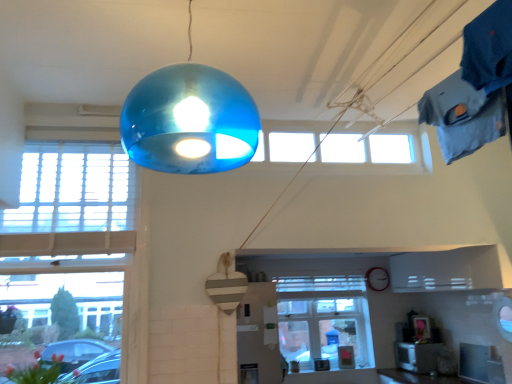
What is the approximate width of vivid pink petals at lower left?

It is 9.75 inches.

This screenshot has width=512, height=384. What do you see at coordinates (374, 151) in the screenshot? I see `transparent glass window at upper center, which is the second window in left-to-right order` at bounding box center [374, 151].

Describe the element at coordinates (74, 229) in the screenshot. I see `white wooden window at left, which is the 1th window in front-to-back order` at that location.

This screenshot has width=512, height=384. What do you see at coordinates (323, 319) in the screenshot?
I see `clear glass window at center, the first window from the back` at bounding box center [323, 319].

Locate an element on the screen. This screenshot has width=512, height=384. vivid pink petals at lower left is located at coordinates (36, 371).

Is vivid pink petals at lower left in front of white wooden window at left, which is the 1th window in front-to-back order?

That is True.

From the image's perspective, is vivid pink petals at lower left over white wooden window at left, which is the 1th window from left to right?

No, from the image's perspective, vivid pink petals at lower left is not on top of white wooden window at left, which is the 1th window from left to right.

Does vivid pink petals at lower left have a lesser height compared to white wooden window at left, marked as the 3th window in a right-to-left arrangement?

Correct, vivid pink petals at lower left is not as tall as white wooden window at left, marked as the 3th window in a right-to-left arrangement.

Is vivid pink petals at lower left inside the boundaries of white wooden window at left, which is the 1th window in front-to-back order, or outside?

A: vivid pink petals at lower left is contained in white wooden window at left, which is the 1th window in front-to-back order.

Considering the sizes of objects transparent glass window at upper center, arranged as the second window when viewed from the front, and white wooden window at left, which is the 1th window from left to right, in the image provided, who is smaller, transparent glass window at upper center, arranged as the second window when viewed from the front, or white wooden window at left, which is the 1th window from left to right,?

Smaller between the two is transparent glass window at upper center, arranged as the second window when viewed from the front.

Is transparent glass window at upper center, arranged as the second window when viewed from the front, facing towards white wooden window at left, arranged as the 3th window when viewed from the back?

No.

How distant is transparent glass window at upper center, placed as the 2th window when sorted from right to left, from white wooden window at left, which is the 1th window in front-to-back order?

1.43 meters.

In terms of width, does transparent glass window at upper center, which is the second window in left-to-right order, look wider or thinner when compared to white wooden window at left, arranged as the 3th window when viewed from the back?

transparent glass window at upper center, which is the second window in left-to-right order, is thinner than white wooden window at left, arranged as the 3th window when viewed from the back.

Can you see white wooden window at left, which is the 1th window from left to right, touching vivid pink petals at lower left?

No, white wooden window at left, which is the 1th window from left to right, is not with vivid pink petals at lower left.

Which point is more forward, (88, 220) or (11, 379)?

The point (11, 379) is more forward.

Based on their sizes in the image, would you say white wooden window at left, arranged as the 3th window when viewed from the back, is bigger or smaller than vivid pink petals at lower left?

In the image, white wooden window at left, arranged as the 3th window when viewed from the back, appears to be larger than vivid pink petals at lower left.

Who is more distant, white wooden window at left, which is the 1th window in front-to-back order, or vivid pink petals at lower left?

white wooden window at left, which is the 1th window in front-to-back order, is behind.

In the scene shown: From the image's perspective, is white wooden window at left, marked as the 3th window in a right-to-left arrangement, positioned above or below transparent glass window at upper center, arranged as the second window when viewed from the front?

From the image's perspective, white wooden window at left, marked as the 3th window in a right-to-left arrangement, appears below transparent glass window at upper center, arranged as the second window when viewed from the front.

Can you confirm if white wooden window at left, which is the 1th window from left to right, is wider than transparent glass window at upper center, arranged as the second window when viewed from the front?

Indeed, white wooden window at left, which is the 1th window from left to right, has a greater width compared to transparent glass window at upper center, arranged as the second window when viewed from the front.

Is the position of white wooden window at left, which is the 1th window in front-to-back order, more distant than that of transparent glass window at upper center, placed as the 2th window when sorted from right to left?

No.

Between transparent glass window at upper center, arranged as the second window when viewed from the front, and vivid pink petals at lower left, which one has smaller size?

vivid pink petals at lower left.

From a real-world perspective, who is located lower, transparent glass window at upper center, which is the second window in left-to-right order, or vivid pink petals at lower left?

vivid pink petals at lower left, from a real-world perspective.

Consider the image. Does transparent glass window at upper center, which is the second window in left-to-right order, turn towards vivid pink petals at lower left?

No, transparent glass window at upper center, which is the second window in left-to-right order, is not turned towards vivid pink petals at lower left.

Is vivid pink petals at lower left located outside clear glass window at center, which is the 3th window in left-to-right order?

Indeed, vivid pink petals at lower left is completely outside clear glass window at center, which is the 3th window in left-to-right order.

Based on the photo, which is less distant, (33, 379) or (329, 297)?

Point (33, 379) is positioned closer to the camera compared to point (329, 297).

Can you confirm if vivid pink petals at lower left is positioned to the right of clear glass window at center, which ranks as the first window in right-to-left order?

Incorrect, vivid pink petals at lower left is not on the right side of clear glass window at center, which ranks as the first window in right-to-left order.

Are transparent glass window at upper center, arranged as the second window when viewed from the front, and clear glass window at center, which ranks as the first window in right-to-left order, located far from each other?

Absolutely, transparent glass window at upper center, arranged as the second window when viewed from the front, is distant from clear glass window at center, which ranks as the first window in right-to-left order.

From a real-world perspective, is transparent glass window at upper center, placed as the 2th window when sorted from right to left, physically above clear glass window at center, which ranks as the first window in right-to-left order?

Yes, from a real-world perspective, transparent glass window at upper center, placed as the 2th window when sorted from right to left, is above clear glass window at center, which ranks as the first window in right-to-left order.

Based on their positions, is transparent glass window at upper center, placed as the 2th window when sorted from right to left, located to the left or right of clear glass window at center, which ranks as the first window in right-to-left order?

Based on their positions, transparent glass window at upper center, placed as the 2th window when sorted from right to left, is located to the left of clear glass window at center, which ranks as the first window in right-to-left order.

Which is behind, point (406, 166) or point (305, 349)?

The point (305, 349) is farther from the camera.

From the image's perspective, starting from the vivid pink petals at lower left, which window is the 1st one above? Please provide its 2D coordinates.

[(74, 229)]

Image resolution: width=512 pixels, height=384 pixels. What are the coordinates of `window located in front of the transparent glass window at upper center, placed as the 2th window when sorted from right to left` in the screenshot? It's located at (74, 229).

When comparing their distances from clear glass window at center, which ranks as the first window in right-to-left order, does white wooden window at left, marked as the 3th window in a right-to-left arrangement, or vivid pink petals at lower left seem further?

vivid pink petals at lower left lies further to clear glass window at center, which ranks as the first window in right-to-left order, than the other object.

When comparing their distances from vivid pink petals at lower left, does white wooden window at left, marked as the 3th window in a right-to-left arrangement, or clear glass window at center, the first window from the back, seem further?

clear glass window at center, the first window from the back, lies further to vivid pink petals at lower left than the other object.

Considering their positions, is transparent glass window at upper center, which is the second window in left-to-right order, positioned closer to clear glass window at center, which ranks as the first window in right-to-left order, than vivid pink petals at lower left?

transparent glass window at upper center, which is the second window in left-to-right order.

Which object lies nearer to the anchor point clear glass window at center, which ranks as the first window in right-to-left order, transparent glass window at upper center, which ranks as the 2th window in back-to-front order, or white wooden window at left, which is the 1th window from left to right?

Among the two, transparent glass window at upper center, which ranks as the 2th window in back-to-front order, is located nearer to clear glass window at center, which ranks as the first window in right-to-left order.

Considering their positions, is vivid pink petals at lower left positioned further to white wooden window at left, which is the 1th window in front-to-back order, than transparent glass window at upper center, arranged as the second window when viewed from the front?

transparent glass window at upper center, arranged as the second window when viewed from the front, lies further to white wooden window at left, which is the 1th window in front-to-back order, than the other object.

Estimate the real-world distances between objects in this image. Which object is further from transparent glass window at upper center, which is the second window in left-to-right order, white wooden window at left, which is the 1th window in front-to-back order, or vivid pink petals at lower left?

vivid pink petals at lower left lies further to transparent glass window at upper center, which is the second window in left-to-right order, than the other object.

Based on their spatial positions, is white wooden window at left, arranged as the 3th window when viewed from the back, or transparent glass window at upper center, arranged as the second window when viewed from the front, closer to vivid pink petals at lower left?

white wooden window at left, arranged as the 3th window when viewed from the back, is closer to vivid pink petals at lower left.

In the scene shown: When comparing their distances from vivid pink petals at lower left, does transparent glass window at upper center, which ranks as the 2th window in back-to-front order, or white wooden window at left, marked as the 3th window in a right-to-left arrangement, seem closer?

The object closer to vivid pink petals at lower left is white wooden window at left, marked as the 3th window in a right-to-left arrangement.

In order to click on window between white wooden window at left, which is the 1th window in front-to-back order, and clear glass window at center, which ranks as the first window in right-to-left order, from front to back in this screenshot , I will do `click(374, 151)`.

This screenshot has width=512, height=384. Find the location of `window located between vivid pink petals at lower left and transparent glass window at upper center, arranged as the second window when viewed from the front, in the left-right direction`. window located between vivid pink petals at lower left and transparent glass window at upper center, arranged as the second window when viewed from the front, in the left-right direction is located at coordinates (74, 229).